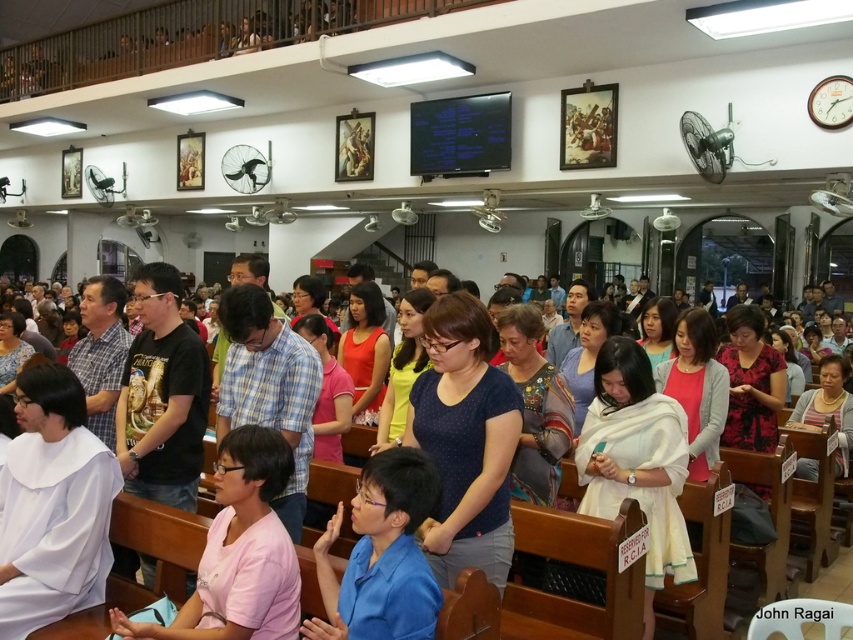
Question: Can you confirm if blue fabric shirt at center is positioned to the left of pink fabric shirt at center?

Choices:
 (A) yes
 (B) no

Answer: (B)

Question: Does blue fabric shirt at center appear over pink fabric shirt at center?

Choices:
 (A) no
 (B) yes

Answer: (B)

Question: Which point is farther to the camera?

Choices:
 (A) blue fabric shirt at center
 (B) pink fabric shirt at center

Answer: (B)

Question: Is blue fabric shirt at center further to the viewer compared to pink fabric shirt at center?

Choices:
 (A) yes
 (B) no

Answer: (B)